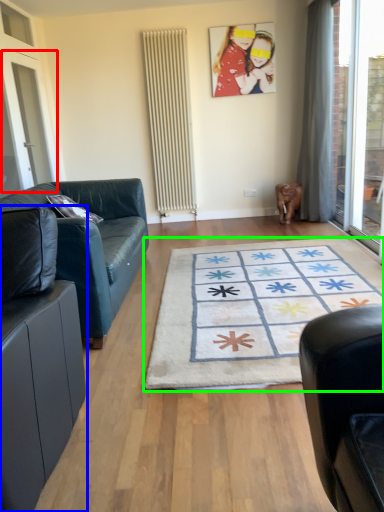
Question: Considering the real-world distances, which object is farthest from screen door (highlighted by a red box)? studio couch (highlighted by a blue box) or mat (highlighted by a green box)?

Choices:
 (A) studio couch
 (B) mat

Answer: (A)